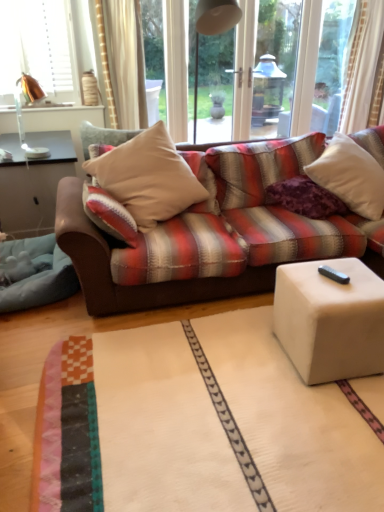
Where is `vacant area located to the right-hand side of black plastic remote control at lower right`? The image size is (384, 512). vacant area located to the right-hand side of black plastic remote control at lower right is located at coordinates (361, 275).